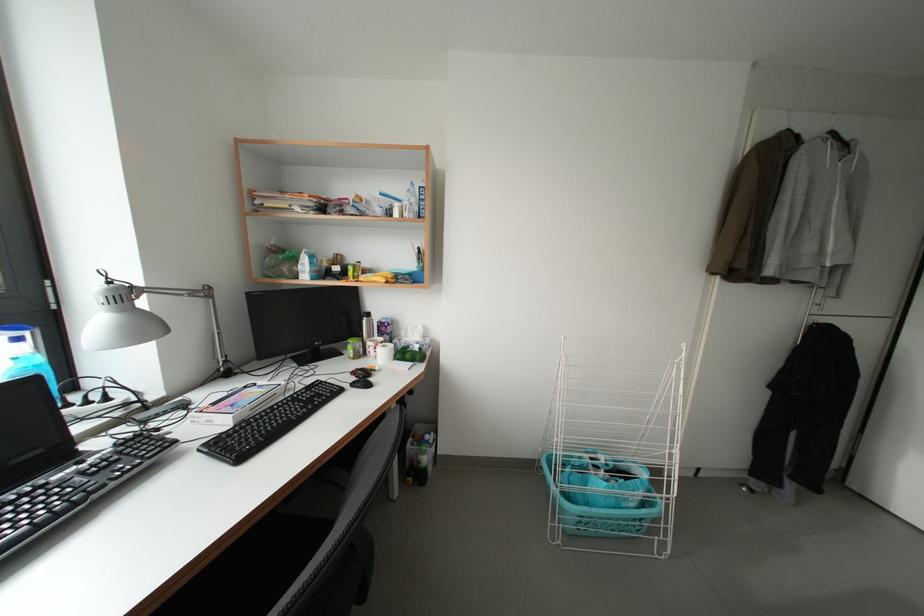
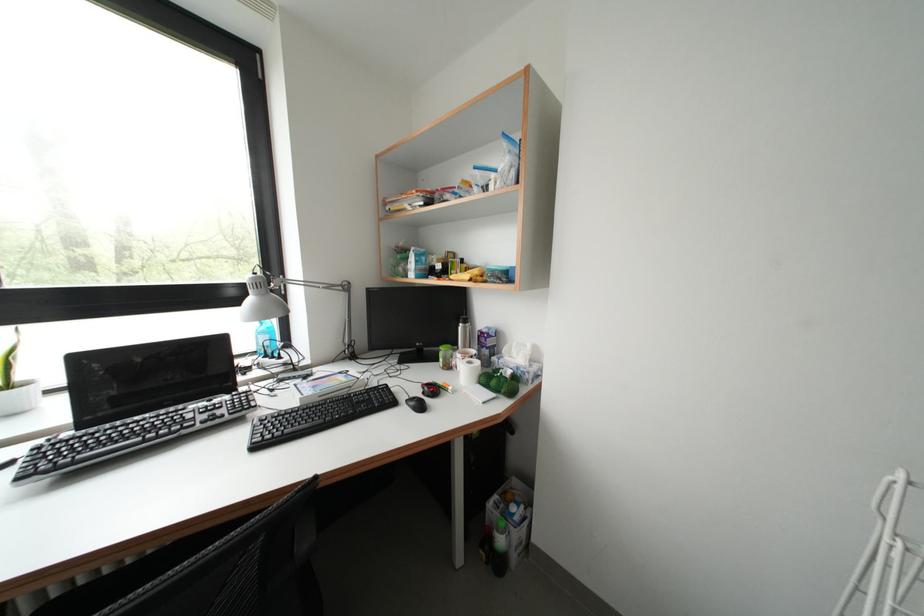
In the second image, find the point that corresponds to point (415, 361) in the first image.

(500, 387)